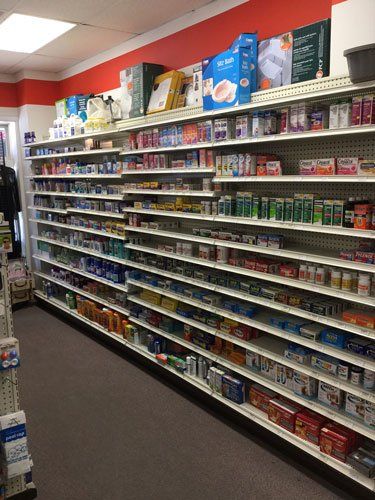
Identify the location of bottom shelf. The image size is (375, 500). (229, 403).